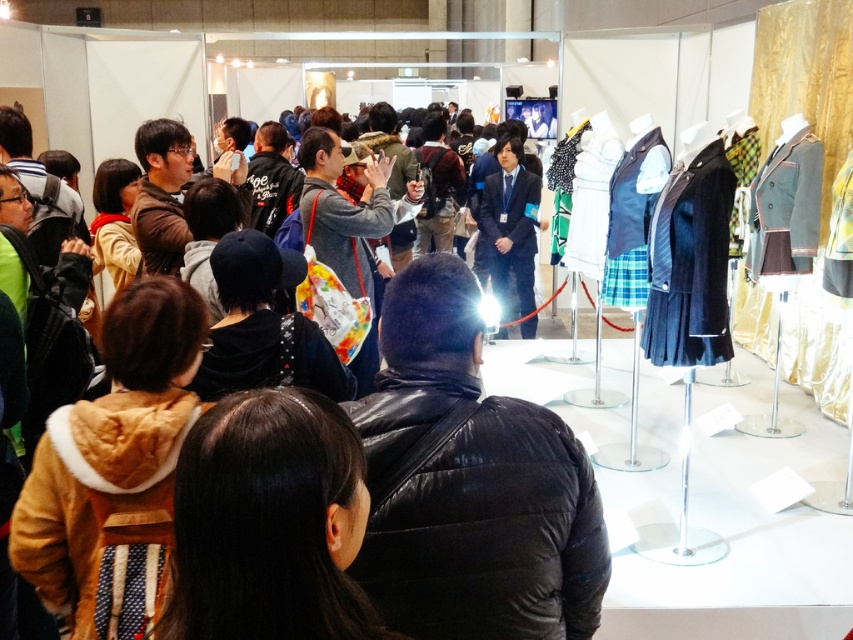
You are attending a fashion show and want to take a photo of the display of school uniforms. You notice the black leather jacket at center and the brown fur coat at lower left. Which object is taller and might block your view if you stand in front of it?

The black leather jacket at center is taller than the brown fur coat at lower left, so it might block your view if you stand in front of it.

You are a photographer at the event and need to capture a photo that includes both the black leather jacket at center and the brown fur coat at lower left. What is the minimum distance you should set your camera to ensure both are in focus?

The black leather jacket at center is 32.41 centimeters from the brown fur coat at lower left. To ensure both are in focus, the camera should be set to a distance that accommodates this separation, typically using a small aperture for a deeper depth of field.

You are a photographer at the event and need to capture a clear photo of both the black leather jacket at center and the brown fur coat at lower left. Considering their sizes, which one might require you to adjust your camera settings for better focus?

The black leather jacket at center has a larger size compared to the brown fur coat at lower left, so you might need to adjust the camera settings to focus on the larger jacket to ensure clarity.